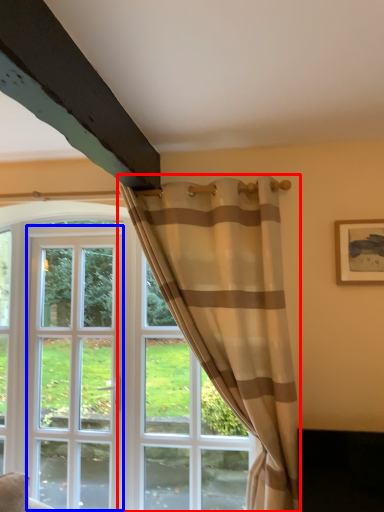
Question: Which of the following is the farthest to the observer, curtain (highlighted by a red box) or screen door (highlighted by a blue box)?

Choices:
 (A) curtain
 (B) screen door

Answer: (B)